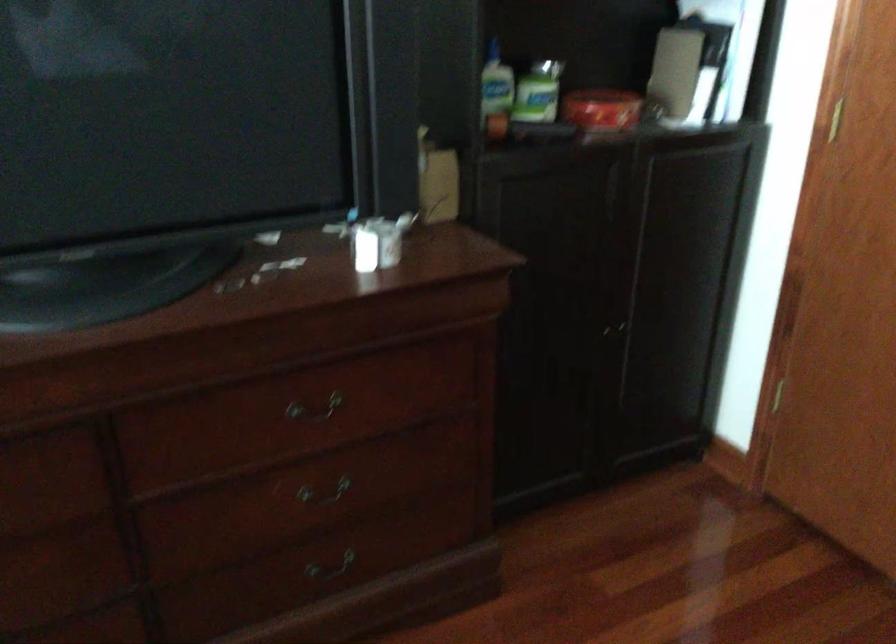
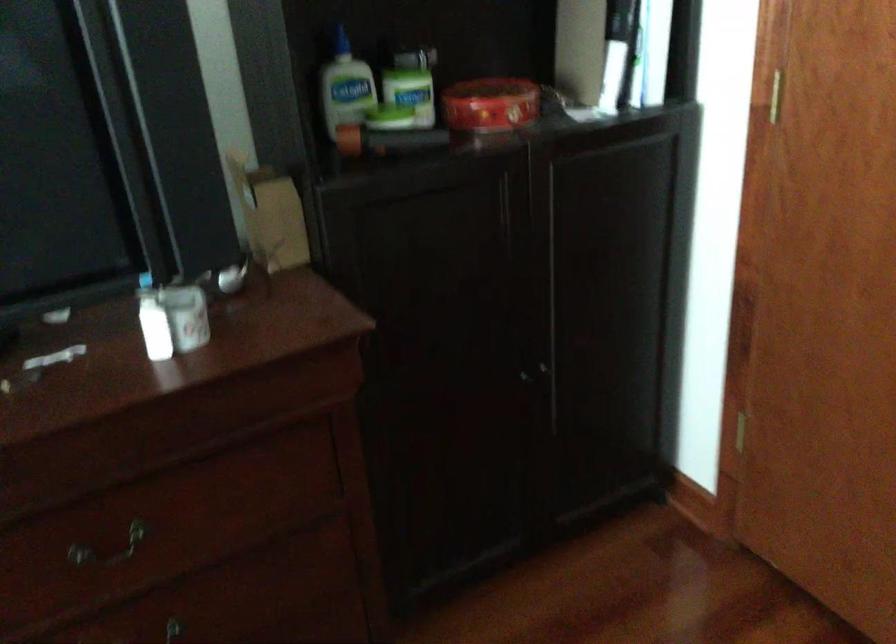
Which direction would the cameraman need to move to produce the second image?

The cameraman moved toward right, forward.